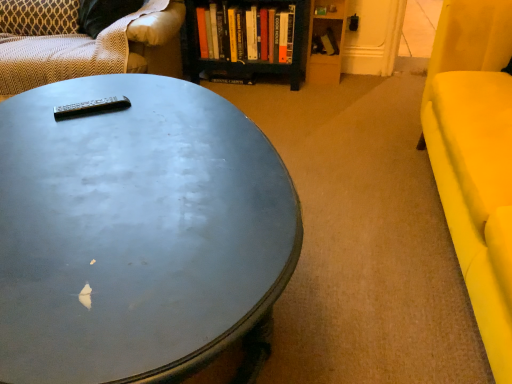
Identify the location of free region on the left part of black plastic remote at center. The image size is (512, 384). (33, 112).